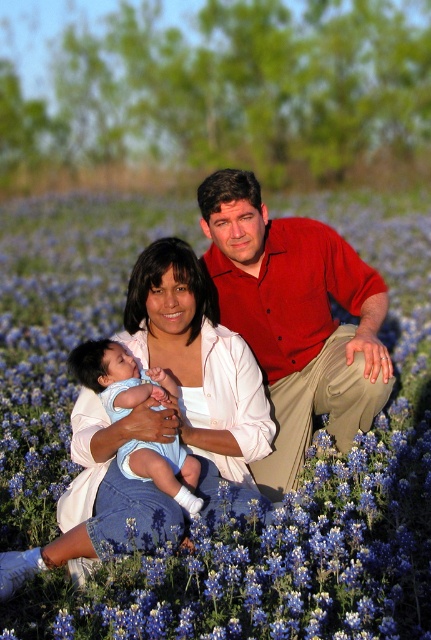
You are a photographer trying to capture a closeup of the matte red shirt at center and the light blue denim baby at center. Since you want both subjects to be in focus, which one should you adjust your camera focus to prioritize based on their sizes?

The matte red shirt at center is larger in size than the light blue denim baby at center, so you should prioritize focusing on the matte red shirt at center to ensure both are in focus.

You are a photographer wanting to capture the blue soft petals at center and the matte red shirt at center in the same frame. Based on their heights, which object would appear larger in the photo?

The blue soft petals at center would appear larger in the photo because they are much taller than the matte red shirt at center.

You are a photographer trying to capture a closeup of the blue soft petals at center while ensuring the light blue denim baby at center is still visible in the frame. Given their sizes, which object should you focus on to include both in the composition?

The blue soft petals at center are larger than the light blue denim baby at center, so focusing on the blue soft petals at center will allow both to be visible in the frame while maintaining the baby in the composition.